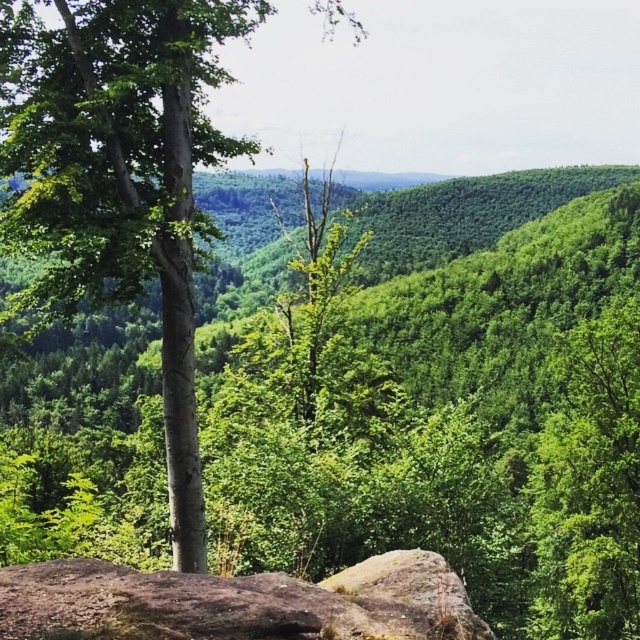
You are a hiker who wants to cross a rocky area in the forest. You see a green matte tree at center and a brown rough rock at lower center. Which object is wider, and can you use the wider one as a landmark to navigate around the rocks?

The green matte tree at center is wider than the brown rough rock at lower center. You can use the green matte tree at center as a landmark to navigate around the rocks since it is wider and more visible.

You are standing at the edge of a forest and see a point marked at coordinates [120,177]. What object in the forest does this point most likely indicate?

The point at coordinates [120,177] most likely indicates the green matte tree at center.